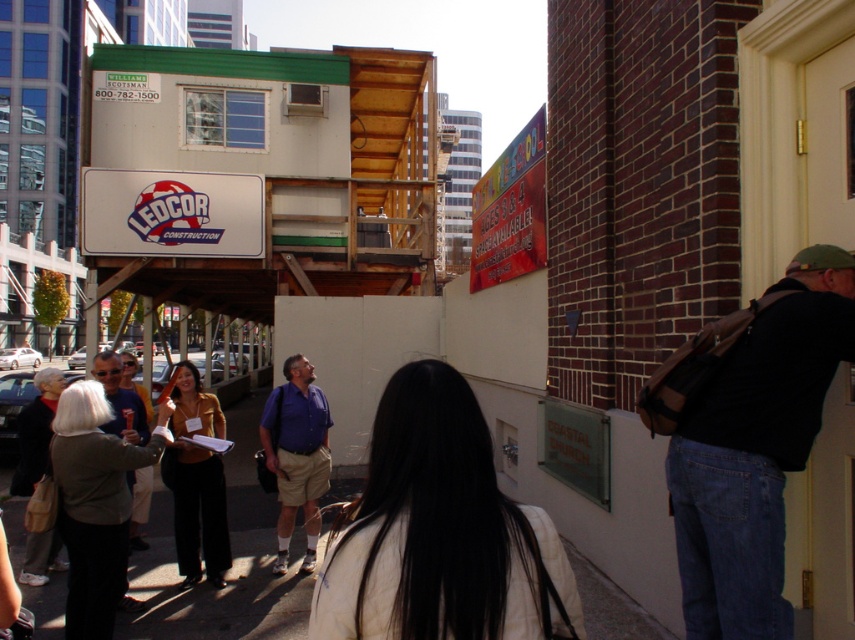
Question: Which point is closer to the camera?

Choices:
 (A) smooth concrete pavement at lower center
 (B) black leather backpack at right

Answer: (B)

Question: Which point appears farthest from the camera in this image?

Choices:
 (A) (812, 296)
 (B) (157, 493)
 (C) (113, 424)
 (D) (186, 480)

Answer: (B)

Question: Does white matte jacket at center have a lesser width compared to matte gold blouse at center?

Choices:
 (A) yes
 (B) no

Answer: (A)

Question: From the image, what is the correct spatial relationship of black leather backpack at right in relation to gray fabric jacket at lower left?

Choices:
 (A) above
 (B) below

Answer: (B)

Question: Among these points, which one is nearest to the camera?

Choices:
 (A) (187, 381)
 (B) (624, 611)
 (C) (783, 461)
 (D) (307, 483)

Answer: (C)

Question: Does white matte jacket at center appear under black leather backpack at right?

Choices:
 (A) no
 (B) yes

Answer: (B)